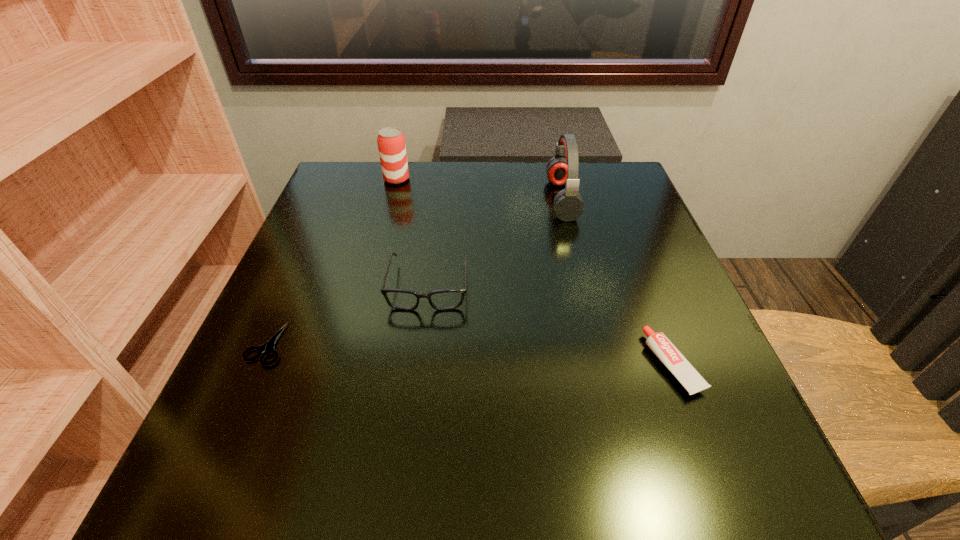
This screenshot has width=960, height=540. What are the coordinates of `vacant space at the near left corner of the desktop` in the screenshot? It's located at (190, 505).

The width and height of the screenshot is (960, 540). What are the coordinates of `unoccupied area between the leftmost object and the third nearest object` in the screenshot? It's located at (348, 315).

This screenshot has height=540, width=960. What are the coordinates of `free space between the third object from left to right and the beer can` in the screenshot? It's located at (413, 232).

Image resolution: width=960 pixels, height=540 pixels. I want to click on vacant space in between the second tallest object and the tallest object, so click(x=479, y=189).

I want to click on free space between the tallest object and the third object from left to right, so click(x=495, y=242).

Where is `empty space that is in between the tallest object and the beer can`? empty space that is in between the tallest object and the beer can is located at coordinates (479, 189).

You are a GUI agent. You are given a task and a screenshot of the screen. Output one action in this format:
    pyautogui.click(x=<x>, y=<y>)
    Task: Click on the unoccupied position between the third object from left to right and the rightmost object
    This screenshot has height=540, width=960.
    Given the screenshot: What is the action you would take?
    pyautogui.click(x=551, y=325)

This screenshot has width=960, height=540. In order to click on free space between the leftmost object and the earphone in this screenshot , I will do `click(415, 272)`.

You are a GUI agent. You are given a task and a screenshot of the screen. Output one action in this format:
    pyautogui.click(x=<x>, y=<y>)
    Task: Click on the free space between the earphone and the third shortest object
    The width and height of the screenshot is (960, 540).
    Given the screenshot: What is the action you would take?
    pyautogui.click(x=495, y=242)

You are a GUI agent. You are given a task and a screenshot of the screen. Output one action in this format:
    pyautogui.click(x=<x>, y=<y>)
    Task: Click on the vacant space that is in between the second object from left to right and the shears
    The height and width of the screenshot is (540, 960).
    Given the screenshot: What is the action you would take?
    [332, 262]